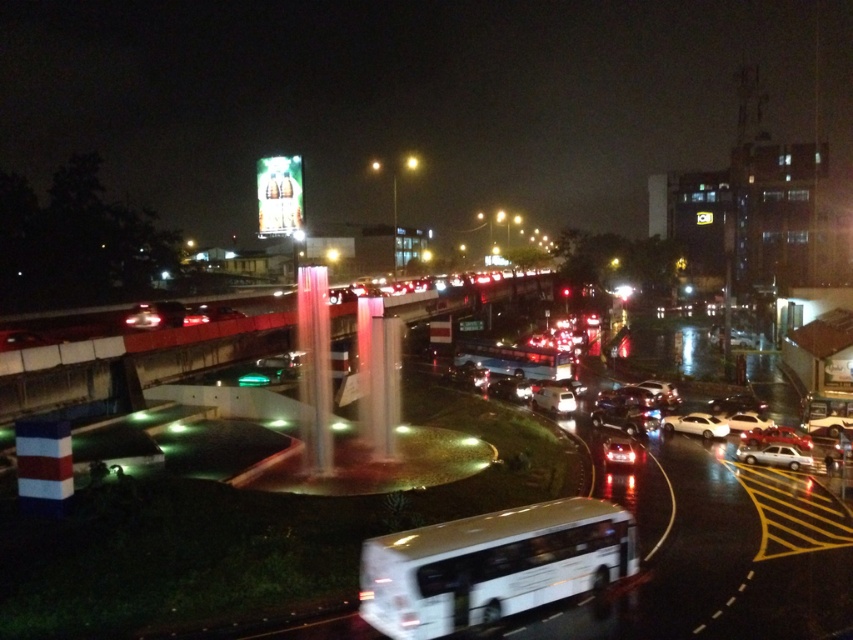
You are a delivery driver who needs to park your white glossy sedan at lower right and your white glossy sedan at center in a parking lot with limited space. Which of the two sedans would require less space to park?

The white glossy sedan at lower right occupies less space than the white glossy sedan at center, so it would require less space to park.

Consider the image. You are a delivery driver who needs to pass through the intersection. Your truck is 20 meters long. There is a white matte bus at center and a shiny red sedan at center in the middle of the road. Can your truck fit between them without touching either vehicle?

The white matte bus at center is 21.92 meters from the shiny red sedan at center. Since your truck is 20 meters long, it can fit between them as the distance between the two vehicles is greater than the truck length.